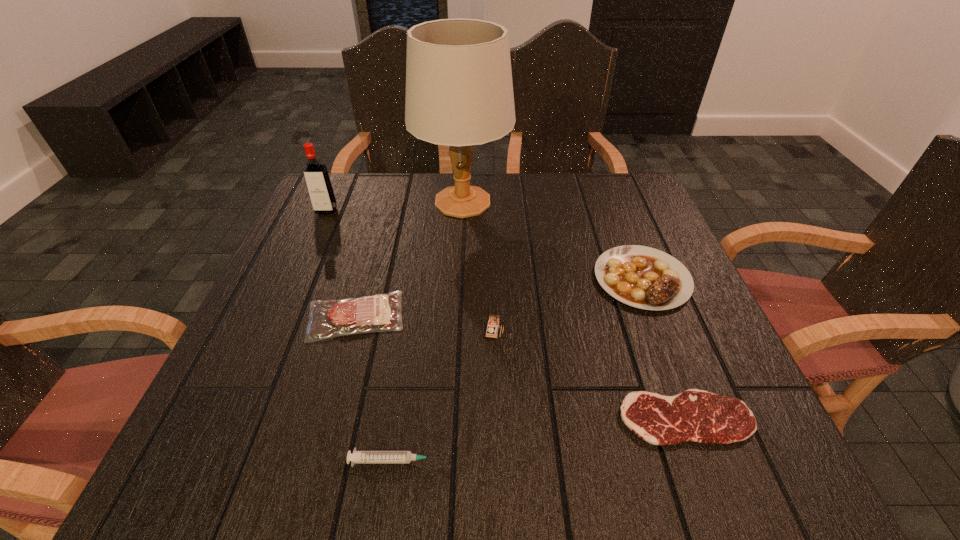
The image size is (960, 540). I want to click on table lamp, so click(459, 92).

Locate an element on the screen. This screenshot has height=540, width=960. the second tallest object is located at coordinates (317, 179).

Where is `the leftmost object`? This screenshot has height=540, width=960. the leftmost object is located at coordinates [317, 179].

Where is `the fifth shortest object`? The image size is (960, 540). the fifth shortest object is located at coordinates (494, 320).

The width and height of the screenshot is (960, 540). What are the coordinates of `the fourth tallest object` in the screenshot? It's located at (643, 277).

You are a GUI agent. You are given a task and a screenshot of the screen. Output one action in this format:
    pyautogui.click(x=<x>, y=<y>)
    Task: Click on the leftmost steak
    The image size is (960, 540).
    Given the screenshot: What is the action you would take?
    pyautogui.click(x=381, y=312)

In order to click on syringe in this screenshot , I will do (358, 457).

The height and width of the screenshot is (540, 960). What are the coordinates of `the sixth farthest object` in the screenshot? It's located at (695, 415).

Locate an element on the screen. the shortest object is located at coordinates 695,415.

Where is `free location located on the left of the tallest object`? Image resolution: width=960 pixels, height=540 pixels. free location located on the left of the tallest object is located at coordinates (341, 202).